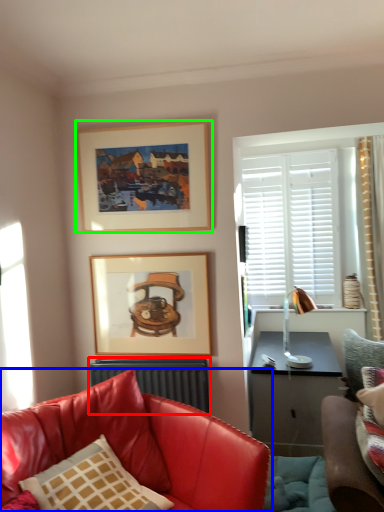
Question: Which object is positioned farthest from radiator (highlighted by a red box)? Select from studio couch (highlighted by a blue box) and picture frame (highlighted by a green box).

Choices:
 (A) studio couch
 (B) picture frame

Answer: (B)